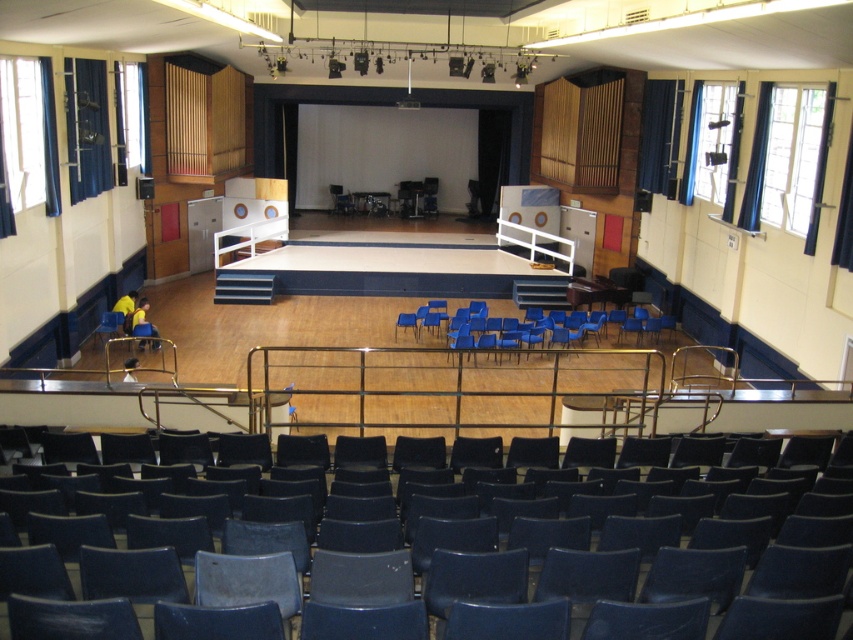
Question: Does blue plastic chair at lower left have a larger size compared to blue plastic chair at center?

Choices:
 (A) yes
 (B) no

Answer: (A)

Question: Is blue plastic chair at lower left above blue plastic chair at center?

Choices:
 (A) no
 (B) yes

Answer: (A)

Question: Which point is farther to the camera?

Choices:
 (A) (751, 589)
 (B) (483, 346)
 (C) (339, 193)
 (D) (120, 324)

Answer: (C)

Question: Which of the following is the closest to the observer?

Choices:
 (A) blue plastic chairs at center
 (B) blue plastic chair at center
 (C) matte blue chair at center
 (D) blue plastic chair at lower left

Answer: (C)

Question: Among these objects, which one is nearest to the camera?

Choices:
 (A) matte blue chair at center
 (B) blue plastic chairs at center
 (C) blue plastic chair at lower left

Answer: (A)

Question: Is blue plastic chairs at center thinner than blue plastic chair at lower left?

Choices:
 (A) no
 (B) yes

Answer: (A)